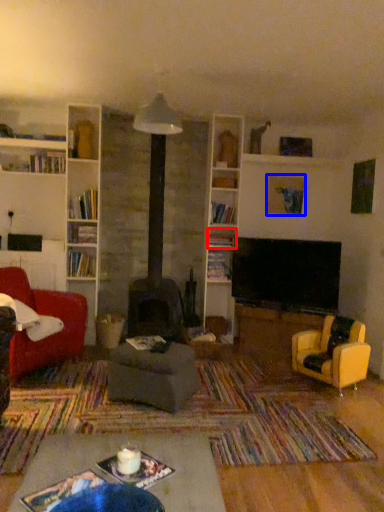
Question: Among these objects, which one is farthest to the camera, shelf (highlighted by a red box) or picture frame (highlighted by a blue box)?

Choices:
 (A) shelf
 (B) picture frame

Answer: (B)